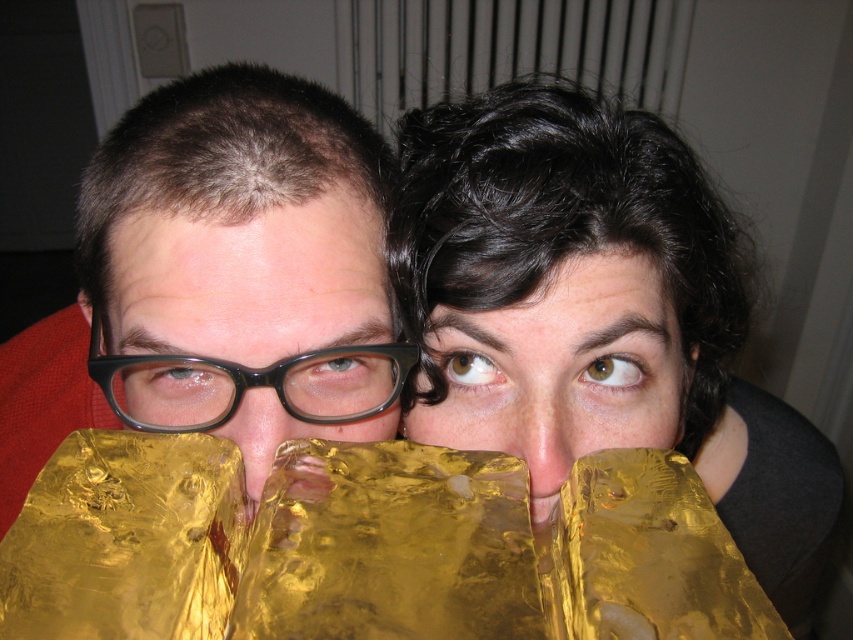
You are trying to determine the spatial relationship between the shiny gold foil at upper right and the matte black glasses at center. Based on the scene, which object is positioned to the right of the other?

The shiny gold foil at upper right is to the right of matte black glasses at center.

You are a delivery person holding a package that requires precise placement within 15 inches of the viewer. You see the matte black glasses at center in the scene. Can you place the package near them without exceeding the distance limit?

The matte black glasses at center is 16.03 inches away from viewer, which is beyond the 15 inches distance limit. Therefore, you cannot place the package near them without exceeding the required distance.